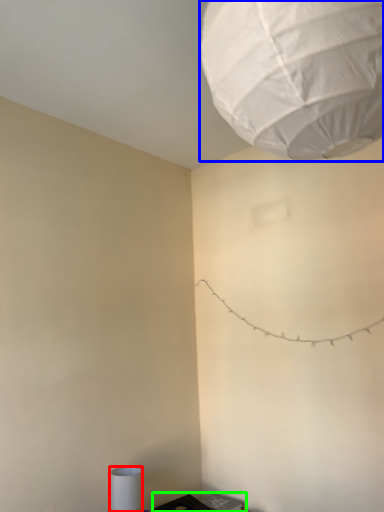
Question: Which is farther away from lamp (highlighted by a red box)? lantern (highlighted by a blue box) or furniture (highlighted by a green box)?

Choices:
 (A) lantern
 (B) furniture

Answer: (A)